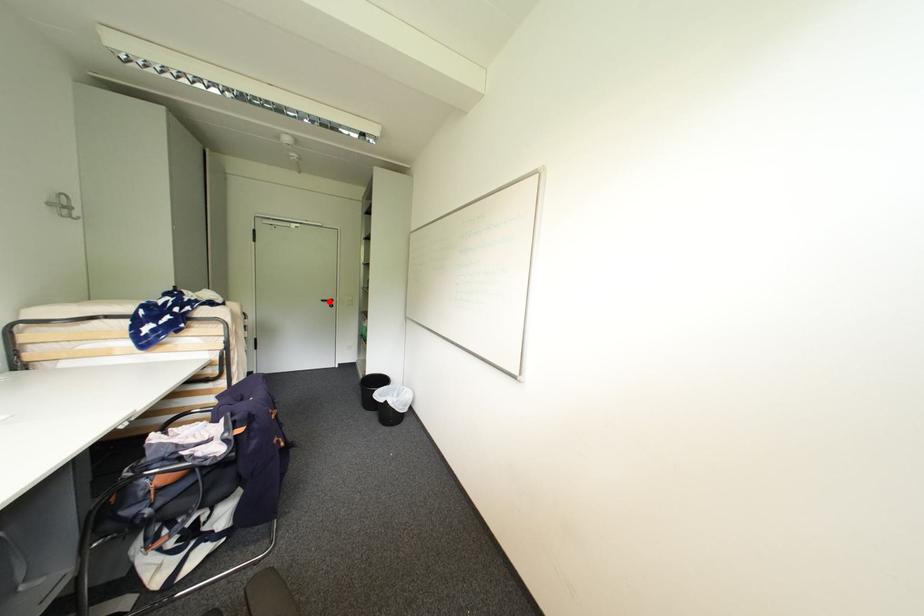
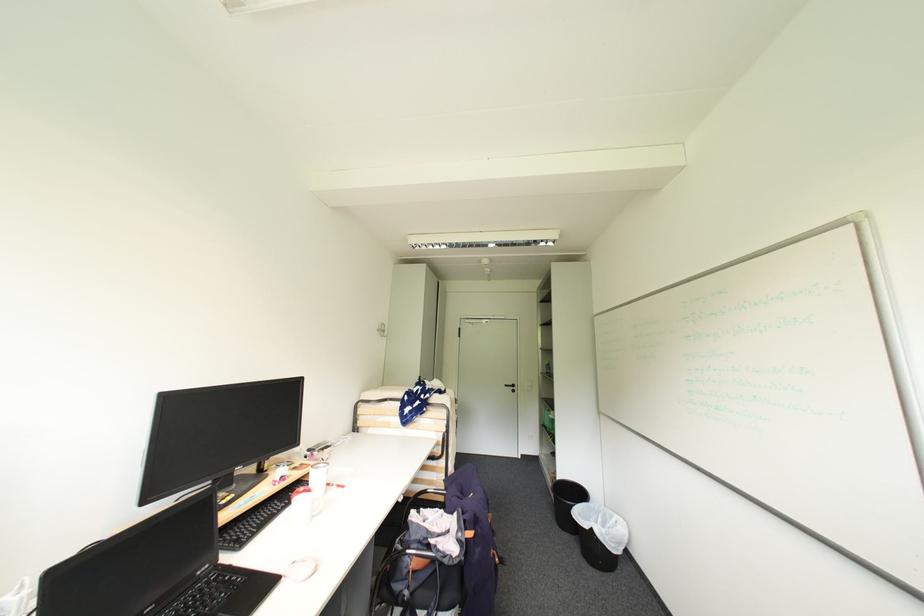
Find the pixel in the second image that matches the highlighted location in the first image.

(513, 387)